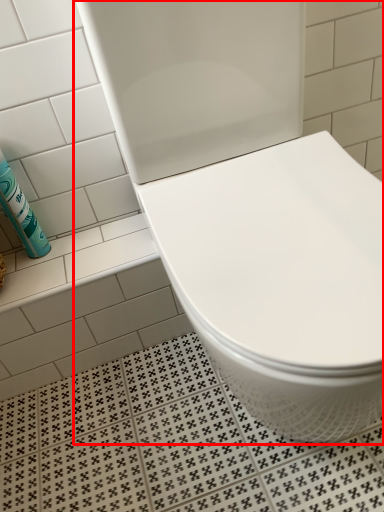
Question: From the image's perspective, what is the correct spatial relationship of toilet (annotated by the red box) in relation to cleaning product?

Choices:
 (A) above
 (B) below

Answer: (B)